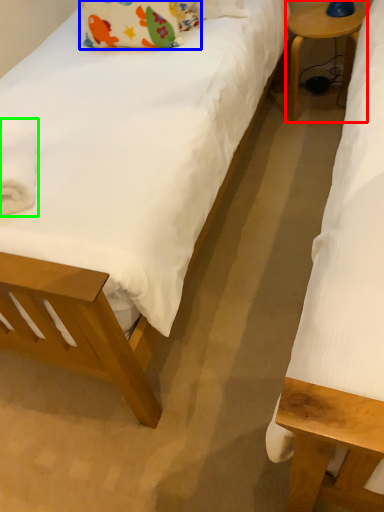
Question: Estimate the real-world distances between objects in this image. Which object is closer to table (highlighted by a red box), pillow (highlighted by a blue box) or material (highlighted by a green box)?

Choices:
 (A) pillow
 (B) material

Answer: (A)